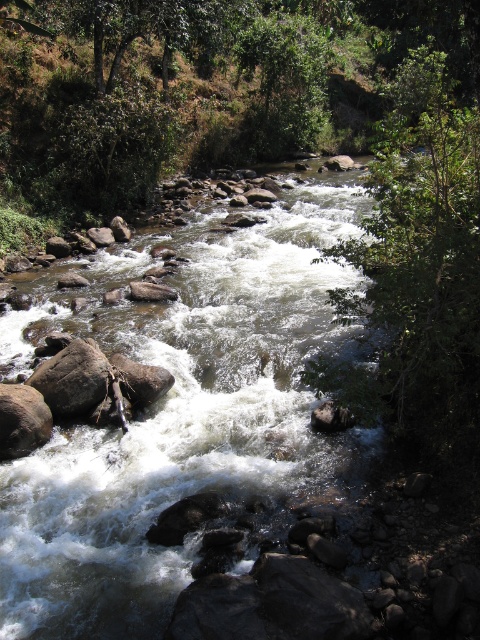
Does point (46, 321) come closer to viewer compared to point (375, 168)?

No, (46, 321) is further to viewer.

Who is taller, brown rocky stream at center or green leafy tree at upper right?

Standing taller between the two is green leafy tree at upper right.

Where is `brown rocky stream at center`? brown rocky stream at center is located at coordinates (177, 408).

Between point (308, 214) and point (255, 116), which one is positioned behind?

The point (255, 116) is more distant.

Does point (357, 205) come farther from viewer compared to point (278, 88)?

No, it is in front of (278, 88).

Who is more distant from viewer, (263,452) or (259,44)?

The point (259,44) is behind.

What are the coordinates of `brown rocky stream at center` in the screenshot? It's located at (177, 408).

Does green leafy tree at upper right have a lesser height compared to green leafy tree at upper center?

In fact, green leafy tree at upper right may be taller than green leafy tree at upper center.

Can you confirm if green leafy tree at upper right is wider than green leafy tree at upper center?

Yes, green leafy tree at upper right is wider than green leafy tree at upper center.

At what (x,y) coordinates should I click in order to perform the action: click on green leafy tree at upper right. Please return your answer as a coordinate pair (x, y). The width and height of the screenshot is (480, 640). Looking at the image, I should click on (421, 264).